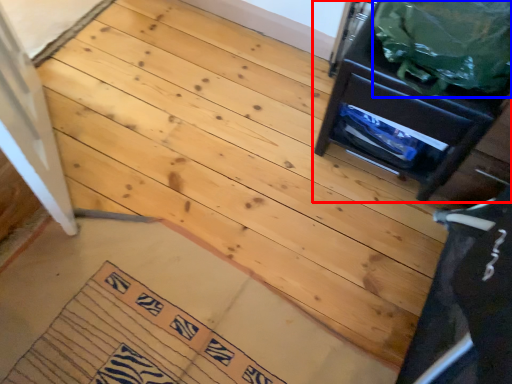
Question: Which object appears closest to the camera in this image, furniture (highlighted by a red box) or garbage (highlighted by a blue box)?

Choices:
 (A) furniture
 (B) garbage

Answer: (B)